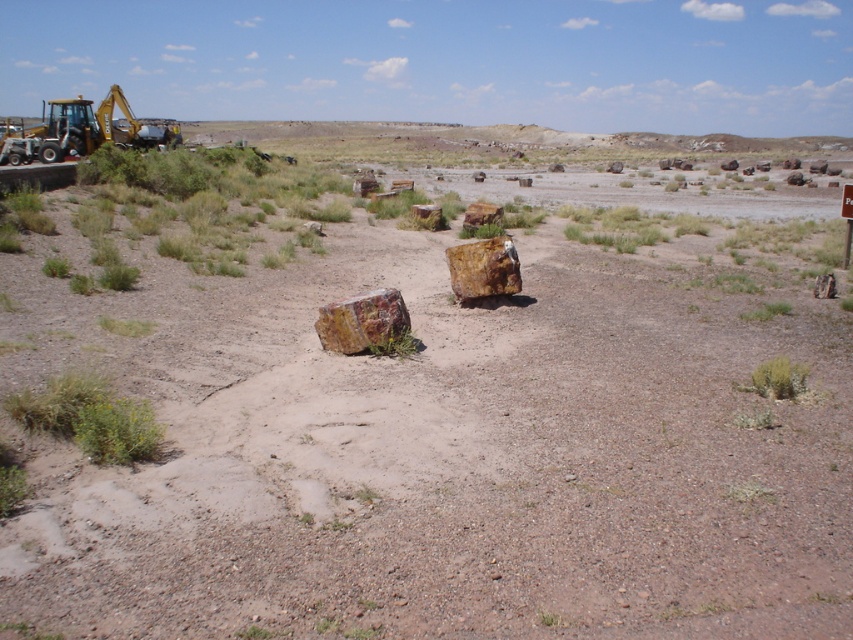
You are standing at the center of the arid landscape described in the scene. You notice a point marked at coordinates (425,440). What object is located at that point?

The point at coordinates (425,440) corresponds to the brown textured rock at center.